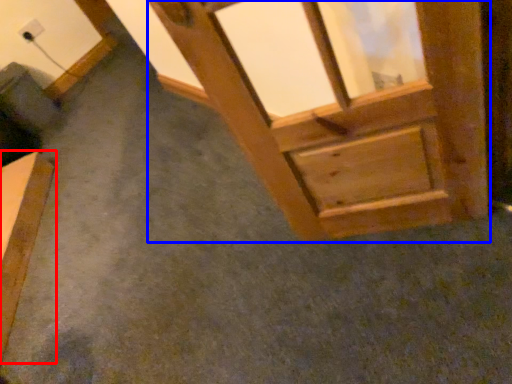
Question: Among these objects, which one is farthest to the camera, furniture (highlighted by a red box) or window frame (highlighted by a blue box)?

Choices:
 (A) furniture
 (B) window frame

Answer: (A)